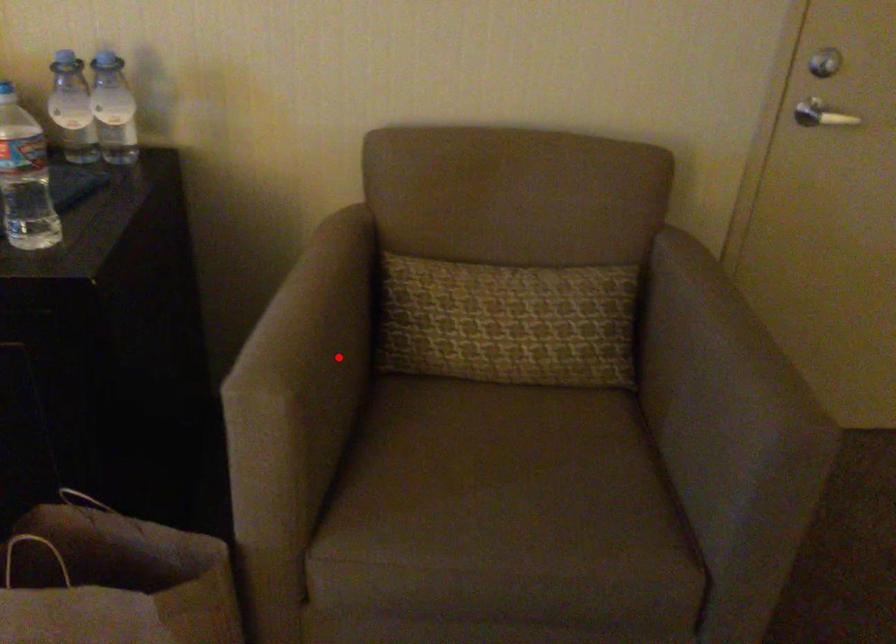
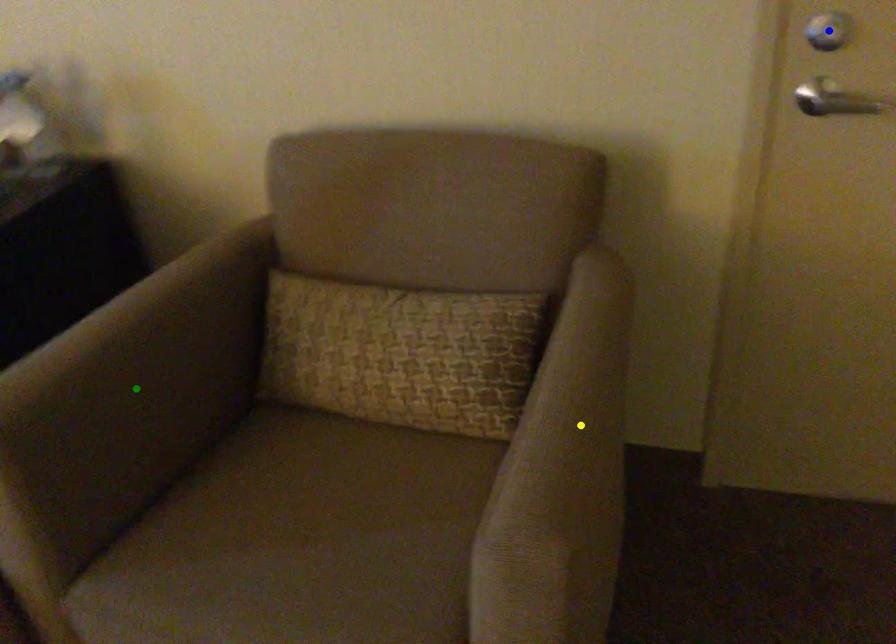
Question: I am providing you with two images of the same scene from different viewpoints. A red point is marked on the first image. You are given multiple points on the second image. In image 2, which mark is for the same physical point as the one in image 1?

Choices:
 (A) yellow point
 (B) blue point
 (C) green point

Answer: (C)